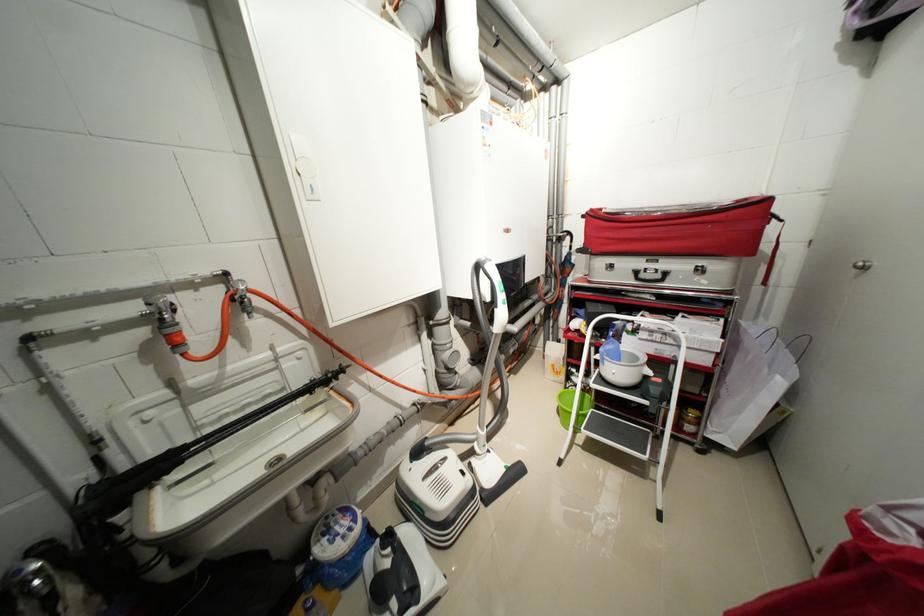
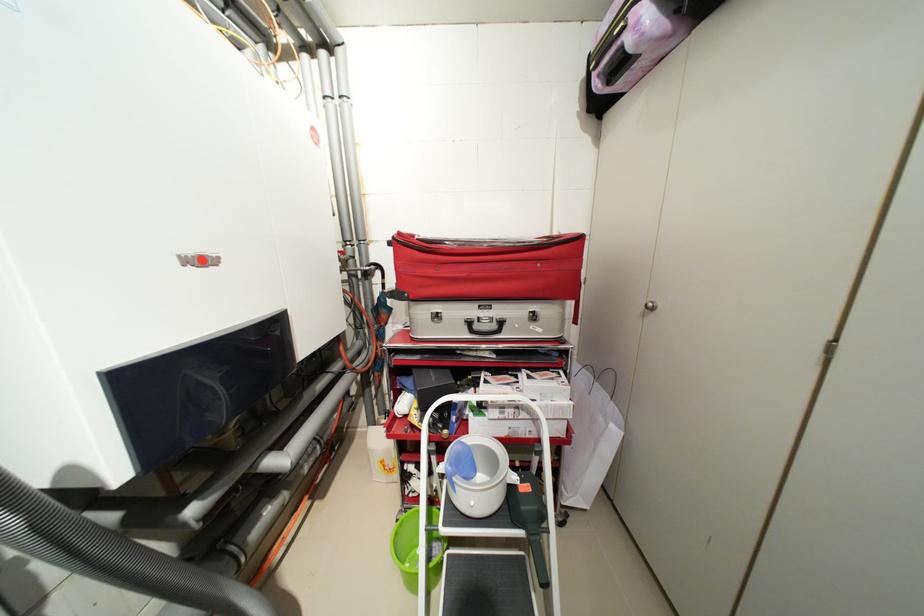
Question: The first image is from the beginning of the video and the second image is from the end. How did the camera likely rotate when shooting the video?

Choices:
 (A) Left
 (B) Right
 (C) Up
 (D) Down

Answer: (B)